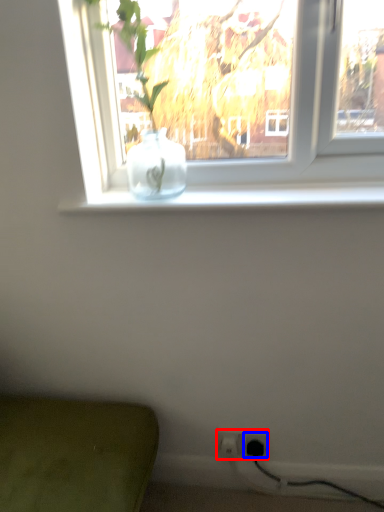
Question: Among these objects, which one is nearest to the camera, electric outlet (highlighted by a red box) or electric outlet (highlighted by a blue box)?

Choices:
 (A) electric outlet
 (B) electric outlet

Answer: (B)